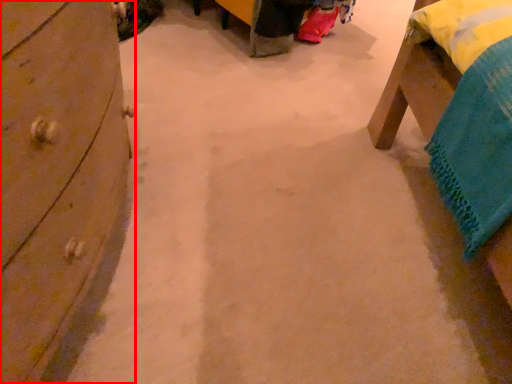
Question: From the image, what is the correct spatial relationship of chest of drawers (annotated by the red box) in relation to furniture?

Choices:
 (A) right
 (B) left

Answer: (B)